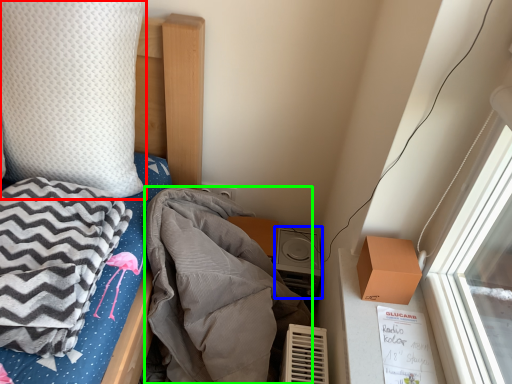
Question: Which object is the farthest from pillow (highlighted by a red box)? Choose among these: stereo (highlighted by a blue box) or blanket (highlighted by a green box).

Choices:
 (A) stereo
 (B) blanket

Answer: (A)